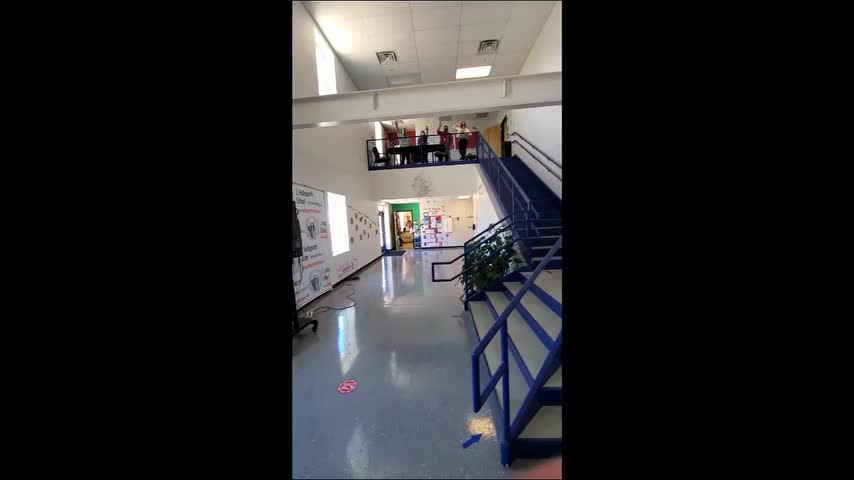
Find the location of a particular element. potted plants is located at coordinates (474, 272), (498, 268).